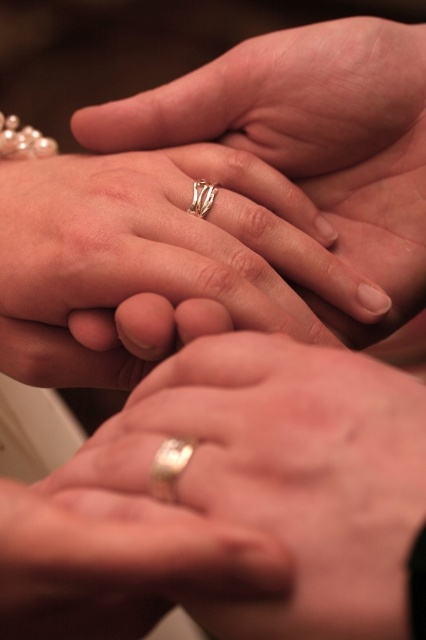
Find the location of a particular element. The image size is (426, 640). gold shiny ring at lower center is located at coordinates (169, 467).

Is gold shiny ring at lower center positioned in front of silver metallic ring at center?

Yes, gold shiny ring at lower center is closer to the viewer.

Who is more forward, [164,442] or [209,209]?

Point [164,442] is more forward.

The image size is (426, 640). Identify the location of gold shiny ring at lower center. tap(169, 467).

Is gold metallic ring at center further to the viewer compared to gold shiny ring at lower center?

No.

Can you confirm if gold metallic ring at center is positioned below gold shiny ring at lower center?

Actually, gold metallic ring at center is above gold shiny ring at lower center.

Between point (331, 600) and point (192, 445), which one is positioned behind?

Positioned behind is point (192, 445).

You are a GUI agent. You are given a task and a screenshot of the screen. Output one action in this format:
    pyautogui.click(x=<x>, y=<y>)
    Task: Click on the gold metallic ring at center
    
    Given the screenshot: What is the action you would take?
    coord(278,476)

Does gold metallic ring at center have a greater width compared to silver metallic ring at center?

Indeed, gold metallic ring at center has a greater width compared to silver metallic ring at center.

Is point (402, 570) closer to viewer compared to point (210, 200)?

Yes, point (402, 570) is in front of point (210, 200).

Locate an element on the screen. The image size is (426, 640). gold metallic ring at center is located at coordinates (278, 476).

I want to click on gold metallic ring at center, so click(x=278, y=476).